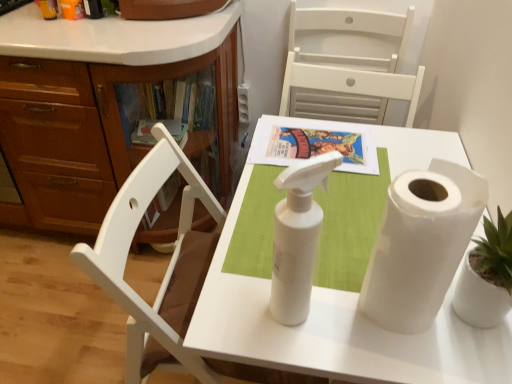
You are a GUI agent. You are given a task and a screenshot of the screen. Output one action in this format:
    pyautogui.click(x=<x>, y=<y>)
    Task: Click on the empty space that is ontop of matte paper book at center (from a real-world perspective)
    The image size is (512, 384).
    Given the screenshot: What is the action you would take?
    pyautogui.click(x=311, y=140)